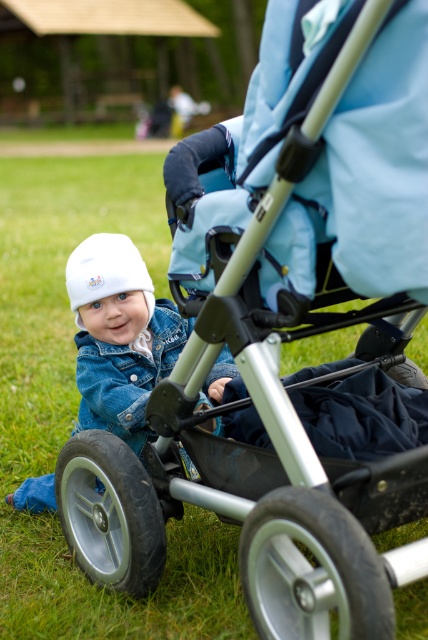
You are a photographer trying to focus on the white matte hat at lower left. According to the coordinates provided, where exactly is the white matte hat positioned in the image?

The white matte hat at lower left is located at point coordinates of 0.525 on the x axis and 0.280 on the y axis.

You are a photographer setting up a shot of the child and stroller. You need to position a reflector to bounce light onto the white fleece hat at center. Which direction should you place the reflector relative to the white matte hat at lower left?

The white matte hat at lower left is to the right of the white fleece hat at center. To reflect light onto the white fleece hat at center, position the reflector to the left of the white matte hat at lower left.